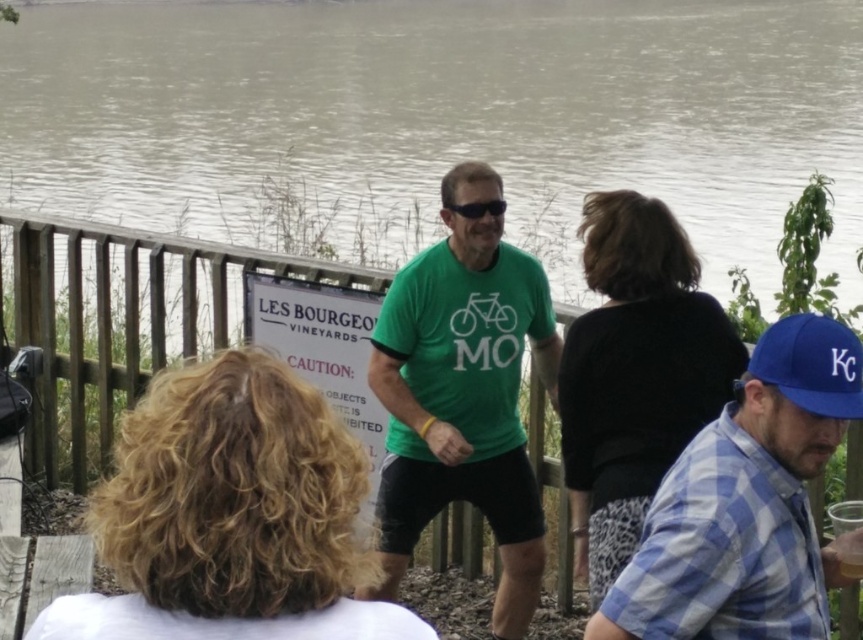
Question: Where is white paper sign at center located in relation to blue fabric baseball cap at right in the image?

Choices:
 (A) left
 (B) right

Answer: (A)

Question: Which point is closer to the camera?

Choices:
 (A) (372, 444)
 (B) (467, 173)
 (C) (463, 209)
 (D) (813, 637)

Answer: (D)

Question: Does blue plaid shirt at lower right appear over black plastic sunglasses at center?

Choices:
 (A) no
 (B) yes

Answer: (A)

Question: Which point is farther from the camera taking this photo?

Choices:
 (A) (455, 211)
 (B) (298, 310)

Answer: (B)

Question: Estimate the real-world distances between objects in this image. Which object is closer to the blue fabric baseball cap at right?

Choices:
 (A) grayish-brown water at upper center
 (B) green matte t-shirt at center

Answer: (B)

Question: Observing the image, what is the correct spatial positioning of green matte t-shirt at center in reference to blue fabric baseball cap at right?

Choices:
 (A) left
 (B) right

Answer: (A)